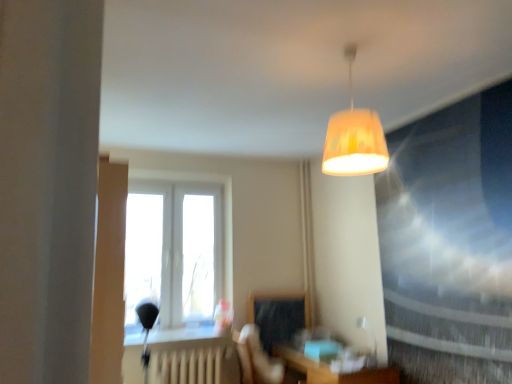
Question: Is wooden table at lower center in front of or behind white glossy table lamp at lower right in the image?

Choices:
 (A) behind
 (B) front

Answer: (B)

Question: Considering the positions of wooden table at lower center and white glossy table lamp at lower right in the image, is wooden table at lower center wider or thinner than white glossy table lamp at lower right?

Choices:
 (A) wide
 (B) thin

Answer: (A)

Question: Which object is positioned farthest from the matte yellow lampshade at center?

Choices:
 (A) white matte radiator at lower center
 (B) matte glass window screen at upper right
 (C) wooden table at lower center
 (D) matte black swivel chair at center
 (E) white glossy table lamp at lower right

Answer: (A)

Question: Which is nearer to the matte yellow lampshade at center?

Choices:
 (A) white glossy table lamp at lower right
 (B) matte glass window screen at upper right
 (C) white matte radiator at lower center
 (D) matte black swivel chair at center
 (E) white plastic window at center

Answer: (B)